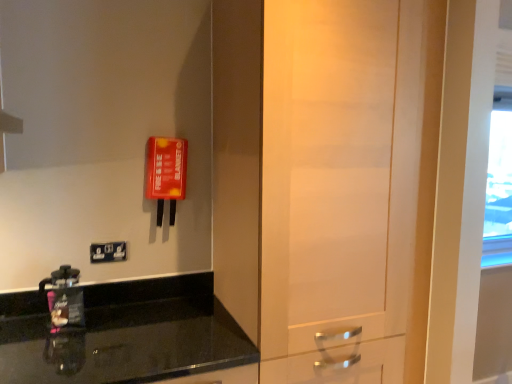
Question: From the image's perspective, is black granite countertop at lower left located above or below matte wood door at center?

Choices:
 (A) above
 (B) below

Answer: (B)

Question: From a real-world perspective, is black granite countertop at lower left physically located above or below matte wood door at center?

Choices:
 (A) above
 (B) below

Answer: (B)

Question: Estimate the real-world distances between objects in this image. Which object is closer to the black plastic/light switch at lower left?

Choices:
 (A) matte wood door at center
 (B) matte black coffee maker at lower left
 (C) black granite countertop at lower left

Answer: (B)

Question: Estimate the real-world distances between objects in this image. Which object is farther from the black granite countertop at lower left?

Choices:
 (A) matte wood door at center
 (B) matte black coffee maker at lower left
 (C) black plastic/light switch at lower left

Answer: (A)